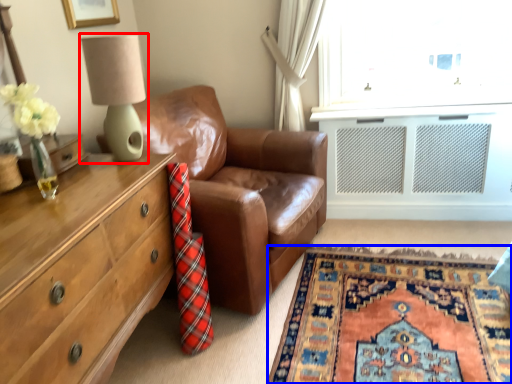
Question: Which point is closer to the camera, table lamp (highlighted by a red box) or plain (highlighted by a blue box)?

Choices:
 (A) table lamp
 (B) plain

Answer: (B)